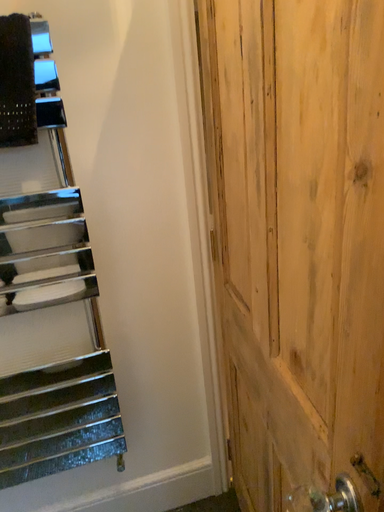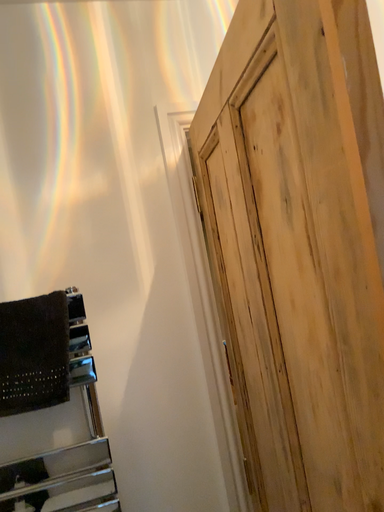
Question: How did the camera likely rotate when shooting the video?

Choices:
 (A) rotated downward
 (B) rotated upward

Answer: (B)